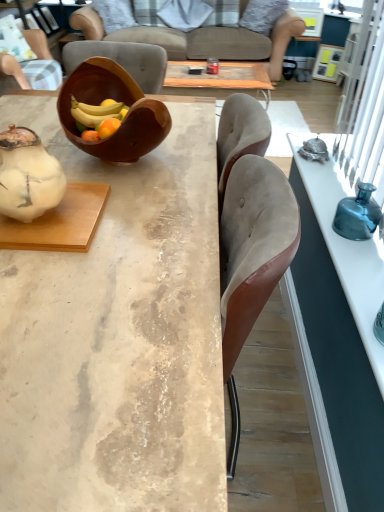
The image size is (384, 512). Identify the location of marble table at center, which ranks as the first desk in left-to-right order. (118, 335).

The height and width of the screenshot is (512, 384). What do you see at coordinates (358, 215) in the screenshot?
I see `blue glass bottle at right` at bounding box center [358, 215].

This screenshot has width=384, height=512. What do you see at coordinates (59, 30) in the screenshot?
I see `matte wood cabinet at upper left` at bounding box center [59, 30].

What is the approximate width of suede chair at upper left?

The width of suede chair at upper left is 14.88 inches.

What do you see at coordinates (119, 101) in the screenshot? I see `brown wooden bowl at center` at bounding box center [119, 101].

The height and width of the screenshot is (512, 384). I want to click on beige fabric couch at upper center, so click(x=156, y=35).

In the image, is matte wood cabinet at upper left on the left side or the right side of fluffy gray pillow at upper center, the 1th pillow positioned from the right?

Clearly, matte wood cabinet at upper left is on the left of fluffy gray pillow at upper center, the 1th pillow positioned from the right, in the image.

Does point (59, 52) lie in front of point (261, 2)?

Yes, point (59, 52) is closer to viewer.

What's the angular difference between matte wood cabinet at upper left and fluffy gray pillow at upper center, which is the 2th pillow in left-to-right order,'s facing directions?

The facing directions of matte wood cabinet at upper left and fluffy gray pillow at upper center, which is the 2th pillow in left-to-right order, are 144 degrees apart.

From a real-world perspective, is matte wood cabinet at upper left above or below fluffy gray pillow at upper center, which is the 2th pillow in left-to-right order?

Clearly, from a real-world perspective, matte wood cabinet at upper left is below fluffy gray pillow at upper center, which is the 2th pillow in left-to-right order.

The image size is (384, 512). Find the location of `tea pot located on the left of fluffy gray pillow at upper center, the 1th pillow positioned from the right`. tea pot located on the left of fluffy gray pillow at upper center, the 1th pillow positioned from the right is located at coordinates (28, 175).

Can you confirm if fluffy gray pillow at upper center, which is the 2th pillow in left-to-right order, is smaller than white matte teapot at left?

Actually, fluffy gray pillow at upper center, which is the 2th pillow in left-to-right order, might be larger than white matte teapot at left.

Is fluffy gray pillow at upper center, the 1th pillow positioned from the right, oriented towards white matte teapot at left?

No, fluffy gray pillow at upper center, the 1th pillow positioned from the right, does not turn towards white matte teapot at left.

Consider the image. Can you confirm if marble table at center, which ranks as the first desk in left-to-right order, is positioned to the right of white fabric pillow at upper center, positioned as the first pillow in left-to-right order?

Result: No, marble table at center, which ranks as the first desk in left-to-right order, is not to the right of white fabric pillow at upper center, positioned as the first pillow in left-to-right order.

From the image's perspective, which is above, marble table at center, which ranks as the first desk in left-to-right order, or white fabric pillow at upper center, acting as the 2th pillow starting from the right?

white fabric pillow at upper center, acting as the 2th pillow starting from the right.

Could you tell me if marble table at center, the second desk from the right, is turned towards white fabric pillow at upper center, positioned as the first pillow in left-to-right order?

No, marble table at center, the second desk from the right, is not turned towards white fabric pillow at upper center, positioned as the first pillow in left-to-right order.

From a real-world perspective, between marble table at center, the second desk from the right, and white fabric pillow at upper center, positioned as the first pillow in left-to-right order, who is vertically higher?

white fabric pillow at upper center, positioned as the first pillow in left-to-right order.

Is suede chair at upper left smaller than matte wood cabinet at upper left?

Yes, suede chair at upper left is smaller than matte wood cabinet at upper left.

In terms of height, does suede chair at upper left look taller or shorter compared to matte wood cabinet at upper left?

suede chair at upper left is shorter than matte wood cabinet at upper left.

This screenshot has height=512, width=384. Identify the location of chair in front of the matte wood cabinet at upper left. (18, 72).

Relative to matte wood cabinet at upper left, is suede chair at upper left in front or behind?

suede chair at upper left is in front of matte wood cabinet at upper left.

This screenshot has height=512, width=384. Identify the location of studio couch above the teal glass vase at right, the 2th desk from the left (from the image's perspective). (156, 35).

Considering the positions of objects teal glass vase at right, the 2th desk from the left, and beige fabric couch at upper center in the image provided, who is more to the left, teal glass vase at right, the 2th desk from the left, or beige fabric couch at upper center?

beige fabric couch at upper center.

From the image's perspective, relative to beige fabric couch at upper center, is teal glass vase at right, the 2th desk from the left, above or below?

Clearly, from the image's perspective, teal glass vase at right, the 2th desk from the left, is below beige fabric couch at upper center.

Considering the positions of objects teal glass vase at right, acting as the 1th desk starting from the right, and beige fabric couch at upper center in the image provided, who is in front, teal glass vase at right, acting as the 1th desk starting from the right, or beige fabric couch at upper center?

Positioned in front is teal glass vase at right, acting as the 1th desk starting from the right.

From the image's perspective, who appears lower, fluffy gray pillow at upper center, the 1th pillow positioned from the right, or beige fabric couch at upper center?

beige fabric couch at upper center.

Is fluffy gray pillow at upper center, which is the 2th pillow in left-to-right order, directly adjacent to beige fabric couch at upper center?

No, fluffy gray pillow at upper center, which is the 2th pillow in left-to-right order, is not making contact with beige fabric couch at upper center.

Considering the relative sizes of fluffy gray pillow at upper center, the 1th pillow positioned from the right, and beige fabric couch at upper center in the image provided, is fluffy gray pillow at upper center, the 1th pillow positioned from the right, wider than beige fabric couch at upper center?

In fact, fluffy gray pillow at upper center, the 1th pillow positioned from the right, might be narrower than beige fabric couch at upper center.

Does fluffy gray pillow at upper center, which is the 2th pillow in left-to-right order, turn towards beige fabric couch at upper center?

Yes, fluffy gray pillow at upper center, which is the 2th pillow in left-to-right order, is oriented towards beige fabric couch at upper center.

From the image's perspective, count 2nd pillows upward from the matte wood cabinet at upper left and point to it. Please provide its 2D coordinates.

[(184, 14)]

Who is smaller, matte wood cabinet at upper left or white fabric pillow at upper center, acting as the 2th pillow starting from the right?

white fabric pillow at upper center, acting as the 2th pillow starting from the right.

Between matte wood cabinet at upper left and white fabric pillow at upper center, positioned as the first pillow in left-to-right order, which one has smaller width?

Thinner between the two is white fabric pillow at upper center, positioned as the first pillow in left-to-right order.

Can white fabric pillow at upper center, positioned as the first pillow in left-to-right order, be found inside matte wood cabinet at upper left?

No.

What are the coordinates of `cabinetry beneath the fluffy gray pillow at upper center, which is the 2th pillow in left-to-right order (from a real-world perspective)` in the screenshot? It's located at (59, 30).

In order to click on tea pot above the fluffy gray pillow at upper center, the 1th pillow positioned from the right (from a real-world perspective) in this screenshot , I will do `click(28, 175)`.

When comparing their distances from blue glass bottle at right, does white fabric pillow at upper center, acting as the 2th pillow starting from the right, or marble table at center, which ranks as the first desk in left-to-right order, seem further?

white fabric pillow at upper center, acting as the 2th pillow starting from the right, is positioned further to the anchor blue glass bottle at right.

Looking at this image, considering their positions, is marble table at center, which ranks as the first desk in left-to-right order, positioned further to fluffy gray pillow at upper center, the 1th pillow positioned from the right, than brown wooden bowl at center?

Based on the image, marble table at center, which ranks as the first desk in left-to-right order, appears to be further to fluffy gray pillow at upper center, the 1th pillow positioned from the right.

Estimate the real-world distances between objects in this image. Which object is further from fluffy gray pillow at upper center, the 1th pillow positioned from the right, brown wooden bowl at center or blue glass bottle at right?

The object further to fluffy gray pillow at upper center, the 1th pillow positioned from the right, is brown wooden bowl at center.

Based on their spatial positions, is beige fabric couch at upper center or white fabric pillow at upper center, acting as the 2th pillow starting from the right, further from brown wooden bowl at center?

white fabric pillow at upper center, acting as the 2th pillow starting from the right, is further to brown wooden bowl at center.

Based on their spatial positions, is teal glass vase at right, the 2th desk from the left, or white fabric pillow at upper center, positioned as the first pillow in left-to-right order, closer to blue glass bottle at right?

teal glass vase at right, the 2th desk from the left, lies closer to blue glass bottle at right than the other object.

Estimate the real-world distances between objects in this image. Which object is closer to blue glass bottle at right, brown wooden bowl at center or teal glass vase at right, acting as the 1th desk starting from the right?

teal glass vase at right, acting as the 1th desk starting from the right.

From the image, which object appears to be nearer to teal glass vase at right, the 2th desk from the left, suede chair at upper left or white fabric pillow at upper center, acting as the 2th pillow starting from the right?

suede chair at upper left.

Looking at the image, which one is located further to suede chair at upper left, brown wooden bowl at center or teal glass vase at right, the 2th desk from the left?

teal glass vase at right, the 2th desk from the left, is further to suede chair at upper left.

Image resolution: width=384 pixels, height=512 pixels. In order to click on chair between matte wood cabinet at upper left and white fabric pillow at upper center, acting as the 2th pillow starting from the right, from left to right in this screenshot , I will do `click(18, 72)`.

Locate an element on the screen. This screenshot has width=384, height=512. bowl between marble table at center, the second desk from the right, and suede chair at upper left from front to back is located at coordinates (119, 101).

At what (x,y) coordinates should I click in order to perform the action: click on tea pot between marble table at center, which ranks as the first desk in left-to-right order, and fluffy gray pillow at upper center, which is the 2th pillow in left-to-right order, along the z-axis. Please return your answer as a coordinate pair (x, y). This screenshot has width=384, height=512. Looking at the image, I should click on (28, 175).

Locate an element on the screen. Image resolution: width=384 pixels, height=512 pixels. studio couch between marble table at center, which ranks as the first desk in left-to-right order, and fluffy gray pillow at upper center, the 1th pillow positioned from the right, along the z-axis is located at coordinates (156, 35).